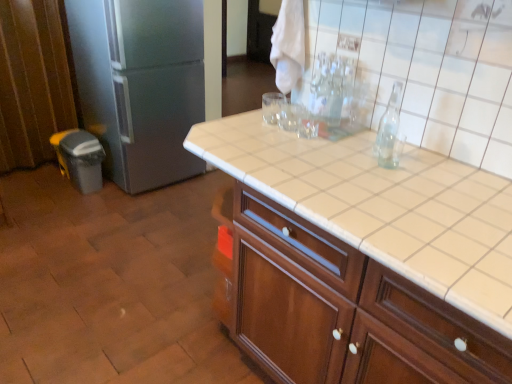
Question: From a real-world perspective, is white tile countertop at center on top of satin silver refrigerator at left?

Choices:
 (A) yes
 (B) no

Answer: (A)

Question: Is white tile countertop at center aimed at satin silver refrigerator at left?

Choices:
 (A) yes
 (B) no

Answer: (B)

Question: Can you confirm if white tile countertop at center is bigger than satin silver refrigerator at left?

Choices:
 (A) yes
 (B) no

Answer: (B)

Question: Is white tile countertop at center looking in the opposite direction of satin silver refrigerator at left?

Choices:
 (A) yes
 (B) no

Answer: (B)

Question: Is white tile countertop at center outside of satin silver refrigerator at left?

Choices:
 (A) yes
 (B) no

Answer: (A)

Question: From the image's perspective, is white tile countertop at center on satin silver refrigerator at left?

Choices:
 (A) no
 (B) yes

Answer: (A)

Question: Does satin silver refrigerator at left come behind white tile countertop at center?

Choices:
 (A) yes
 (B) no

Answer: (A)

Question: Are satin silver refrigerator at left and white tile countertop at center far apart?

Choices:
 (A) no
 (B) yes

Answer: (B)

Question: Does satin silver refrigerator at left contain white tile countertop at center?

Choices:
 (A) no
 (B) yes

Answer: (A)

Question: Can you confirm if satin silver refrigerator at left is thinner than white tile countertop at center?

Choices:
 (A) yes
 (B) no

Answer: (B)

Question: From a real-world perspective, is satin silver refrigerator at left positioned under white tile countertop at center based on gravity?

Choices:
 (A) yes
 (B) no

Answer: (A)

Question: Is satin silver refrigerator at left completely or partially outside of white tile countertop at center?

Choices:
 (A) no
 (B) yes

Answer: (B)

Question: From their relative heights in the image, would you say satin silver refrigerator at left is taller or shorter than white tile countertop at center?

Choices:
 (A) short
 (B) tall

Answer: (B)